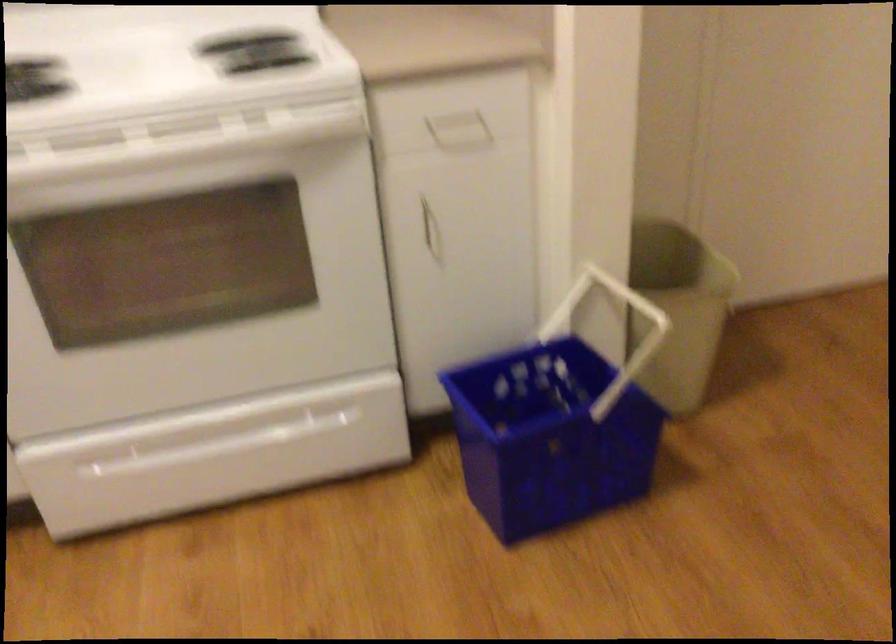
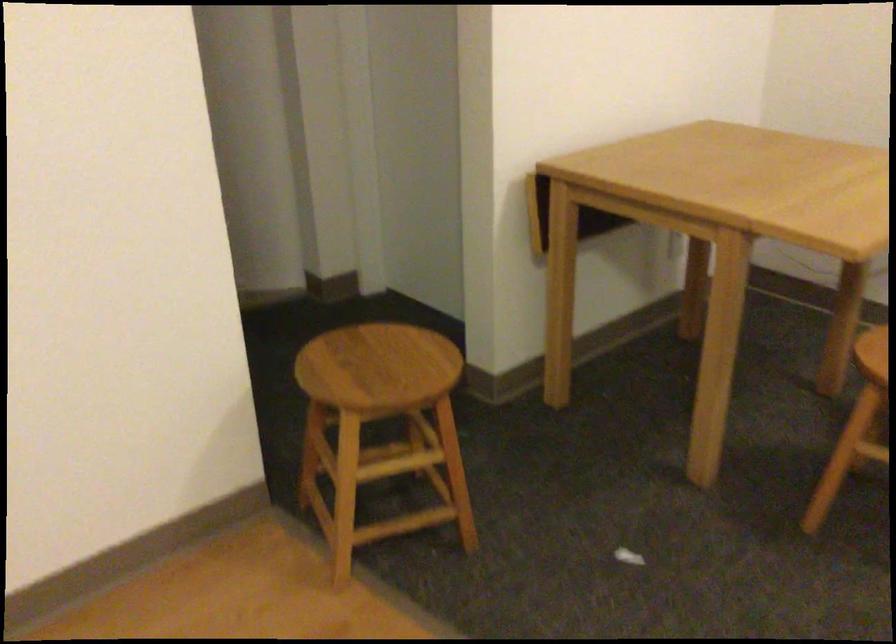
How did the camera likely rotate?

The rotation direction of the camera is right-down.